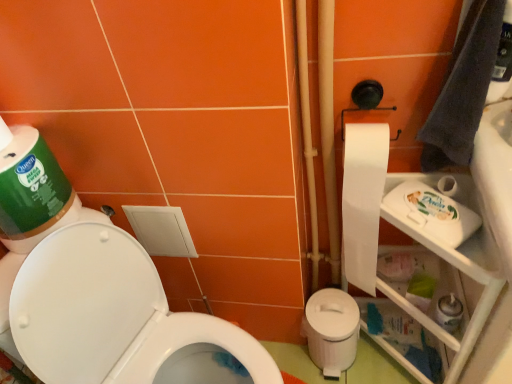
Question: Is white paper at right closer to camera compared to white plastic potty at lower right?

Choices:
 (A) no
 (B) yes

Answer: (B)

Question: Is white paper at right far from white plastic potty at lower right?

Choices:
 (A) no
 (B) yes

Answer: (A)

Question: From a real-world perspective, is white paper at right over white plastic potty at lower right?

Choices:
 (A) yes
 (B) no

Answer: (A)

Question: Does white paper at right appear on the right side of white plastic potty at lower right?

Choices:
 (A) no
 (B) yes

Answer: (B)

Question: Does white paper at right appear on the left side of white plastic potty at lower right?

Choices:
 (A) yes
 (B) no

Answer: (B)

Question: Considering the relative positions of white glossy toilet at lower left and white glossy sink at upper right in the image provided, is white glossy toilet at lower left to the left or to the right of white glossy sink at upper right?

Choices:
 (A) right
 (B) left

Answer: (B)

Question: Considering the positions of white glossy toilet at lower left and white glossy sink at upper right in the image, is white glossy toilet at lower left bigger or smaller than white glossy sink at upper right?

Choices:
 (A) big
 (B) small

Answer: (A)

Question: Looking at their shapes, would you say white glossy toilet at lower left is wider or thinner than white glossy sink at upper right?

Choices:
 (A) thin
 (B) wide

Answer: (B)

Question: In terms of height, does white glossy toilet at lower left look taller or shorter compared to white glossy sink at upper right?

Choices:
 (A) short
 (B) tall

Answer: (B)

Question: In the image, is white plastic shelf at right on the left side or the right side of white paper at right?

Choices:
 (A) right
 (B) left

Answer: (A)

Question: From a real-world perspective, relative to white paper at right, is white plastic shelf at right vertically above or below?

Choices:
 (A) above
 (B) below

Answer: (B)

Question: From the image's perspective, is white plastic shelf at right above or below white paper at right?

Choices:
 (A) above
 (B) below

Answer: (B)

Question: Is white plastic shelf at right bigger or smaller than white paper at right?

Choices:
 (A) big
 (B) small

Answer: (A)

Question: In the image, is white plastic shelf at right positioned in front of or behind white plastic potty at lower right?

Choices:
 (A) front
 (B) behind

Answer: (A)

Question: In terms of width, does white plastic shelf at right look wider or thinner when compared to white plastic potty at lower right?

Choices:
 (A) wide
 (B) thin

Answer: (A)